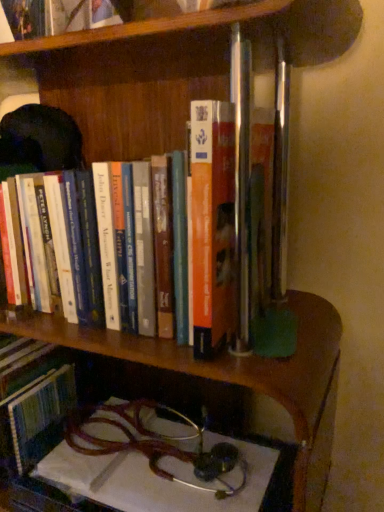
Question: Would you say metallic stethoscope at lower center contains hardcover book at upper center, which is the first book in top-to-bottom order?

Choices:
 (A) yes
 (B) no

Answer: (B)

Question: Is metallic stethoscope at lower center to the left of hardcover book at upper center, positioned as the 2th book in bottom-to-top order, from the viewer's perspective?

Choices:
 (A) yes
 (B) no

Answer: (B)

Question: Is metallic stethoscope at lower center beside hardcover book at upper center, which is the first book in top-to-bottom order?

Choices:
 (A) yes
 (B) no

Answer: (B)

Question: From the image's perspective, is metallic stethoscope at lower center under hardcover book at upper center, positioned as the 2th book in bottom-to-top order?

Choices:
 (A) no
 (B) yes

Answer: (B)

Question: Is metallic stethoscope at lower center far from hardcover book at upper center, which is the first book in top-to-bottom order?

Choices:
 (A) no
 (B) yes

Answer: (A)

Question: Is metallic stethoscope at lower center bigger than hardcover book at upper center, which is the first book in top-to-bottom order?

Choices:
 (A) yes
 (B) no

Answer: (A)

Question: Considering the relative sizes of hardcover book at upper center, which is the first book in top-to-bottom order, and metallic stethoscope at lower center in the image provided, is hardcover book at upper center, which is the first book in top-to-bottom order, smaller than metallic stethoscope at lower center?

Choices:
 (A) yes
 (B) no

Answer: (A)

Question: From a real-world perspective, is hardcover book at upper center, positioned as the 2th book in bottom-to-top order, physically above metallic stethoscope at lower center?

Choices:
 (A) yes
 (B) no

Answer: (A)

Question: Is hardcover book at upper center, positioned as the 2th book in bottom-to-top order, completely or partially outside of metallic stethoscope at lower center?

Choices:
 (A) yes
 (B) no

Answer: (A)

Question: Is metallic stethoscope at lower center a part of hardcover book at upper center, positioned as the 2th book in bottom-to-top order?

Choices:
 (A) yes
 (B) no

Answer: (B)

Question: Considering the relative sizes of hardcover book at upper center, which is the first book in top-to-bottom order, and metallic stethoscope at lower center in the image provided, is hardcover book at upper center, which is the first book in top-to-bottom order, wider than metallic stethoscope at lower center?

Choices:
 (A) no
 (B) yes

Answer: (A)

Question: Considering the relative positions of hardcover book at upper center, positioned as the 2th book in bottom-to-top order, and metallic stethoscope at lower center in the image provided, is hardcover book at upper center, positioned as the 2th book in bottom-to-top order, to the right of metallic stethoscope at lower center from the viewer's perspective?

Choices:
 (A) yes
 (B) no

Answer: (B)

Question: Considering the relative positions of metallic stethoscope at lower center and hardcover book at center, the first book when ordered from bottom to top, in the image provided, is metallic stethoscope at lower center behind hardcover book at center, the first book when ordered from bottom to top,?

Choices:
 (A) no
 (B) yes

Answer: (B)